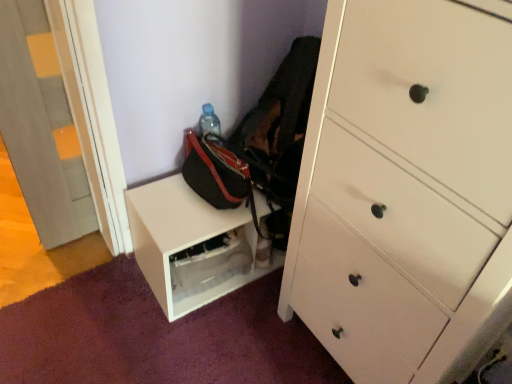
The width and height of the screenshot is (512, 384). What are the coordinates of `vacant region in front of white matte shelf at lower center` in the screenshot? It's located at (202, 339).